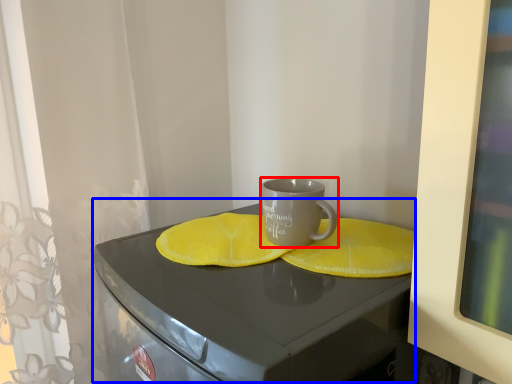
Question: Among these objects, which one is nearest to the camera, coffee cup (highlighted by a red box) or table (highlighted by a blue box)?

Choices:
 (A) coffee cup
 (B) table

Answer: (B)